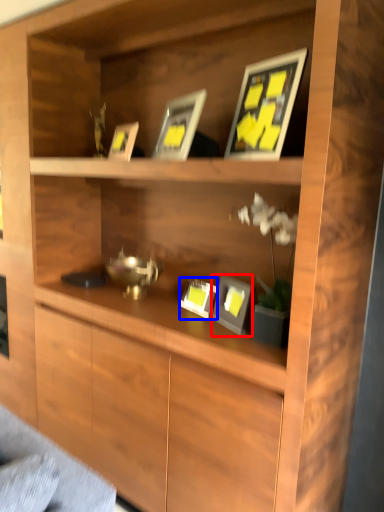
Question: Which point is closer to the camera, picture frame (highlighted by a red box) or picture frame (highlighted by a blue box)?

Choices:
 (A) picture frame
 (B) picture frame

Answer: (A)